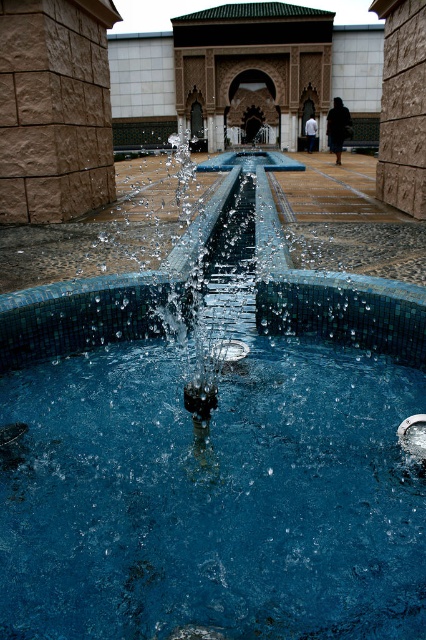
Is blue glossy water at center taller than blue mosaic fountain at center?

No, blue glossy water at center is not taller than blue mosaic fountain at center.

Who is higher up, blue glossy water at center or blue mosaic fountain at center?

Positioned higher is blue mosaic fountain at center.

Measure the distance between point (356, 374) and camera.

The distance of point (356, 374) from camera is 21.68 feet.

Find the location of a particular element. blue glossy water at center is located at coordinates (213, 490).